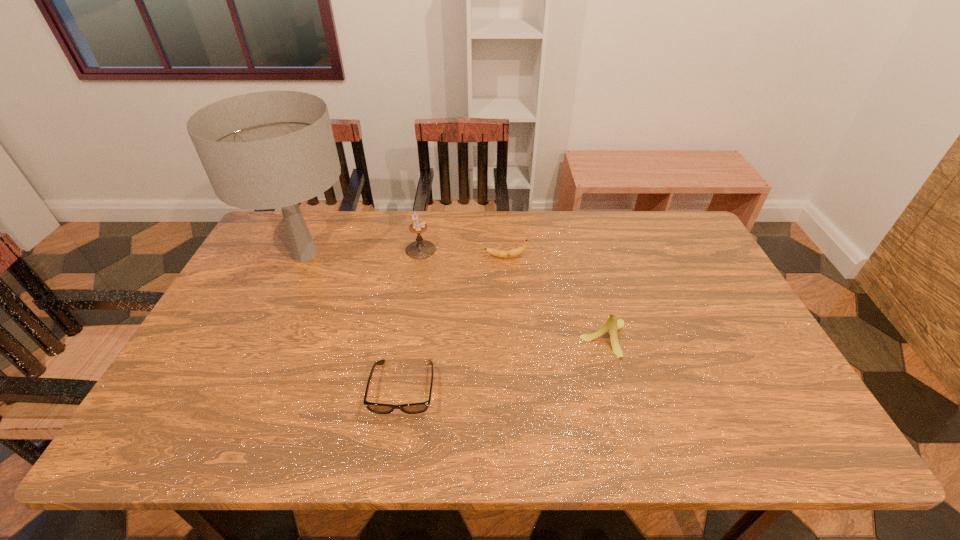
Where is `object at the far left corner`? This screenshot has width=960, height=540. object at the far left corner is located at coordinates (272, 149).

The width and height of the screenshot is (960, 540). I want to click on vacant space at the far edge of the desktop, so click(519, 225).

Image resolution: width=960 pixels, height=540 pixels. Find the location of `vacant space at the near edge`. vacant space at the near edge is located at coordinates (729, 431).

Identify the location of blank space at the left edge. The width and height of the screenshot is (960, 540). tap(269, 291).

Locate an element on the screen. Image resolution: width=960 pixels, height=540 pixels. free space at the right edge of the desktop is located at coordinates (722, 300).

The image size is (960, 540). In order to click on empty space that is in between the second shortest object and the shortest object in this screenshot , I will do `click(454, 323)`.

Identify the location of vacant space that is in between the leftmost object and the shortest object. This screenshot has width=960, height=540. (354, 322).

The width and height of the screenshot is (960, 540). I want to click on free space between the rightmost object and the fourth shortest object, so click(513, 294).

The image size is (960, 540). In order to click on free area in between the second object from right to left and the right banana in this screenshot , I will do `click(555, 298)`.

At what (x,y) coordinates should I click in order to perform the action: click on vacant area that lies between the spectacles and the leftmost object. Please return your answer as a coordinate pair (x, y). This screenshot has height=540, width=960. Looking at the image, I should click on (354, 322).